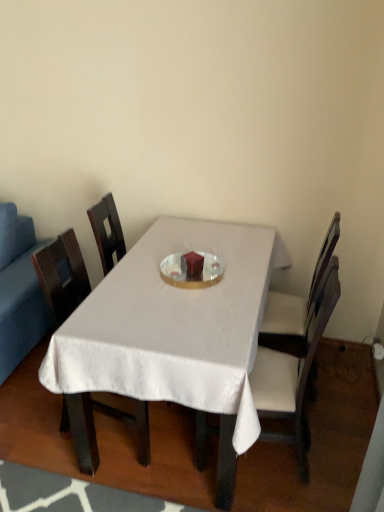
Question: In the image, is white satin table at center on the left side or the right side of blue fabric couch at left?

Choices:
 (A) right
 (B) left

Answer: (A)

Question: Relative to blue fabric couch at left, is white satin table at center in front or behind?

Choices:
 (A) front
 (B) behind

Answer: (A)

Question: Which of these objects is positioned farthest from the wooden chair at center, which is the 3th chair from right to left?

Choices:
 (A) white fabric chair at center, marked as the 2th chair in a left-to-right arrangement
 (B) white satin table at center
 (C) white fabric chair at center, arranged as the 3th chair when viewed from the left
 (D) blue fabric couch at left

Answer: (C)

Question: Estimate the real-world distances between objects in this image. Which object is farther from the white satin table at center?

Choices:
 (A) wooden chair at center, which is the 3th chair from right to left
 (B) white fabric chair at center, which is counted as the first chair, starting from the right
 (C) blue fabric couch at left
 (D) white fabric chair at center, the second chair from the right

Answer: (C)